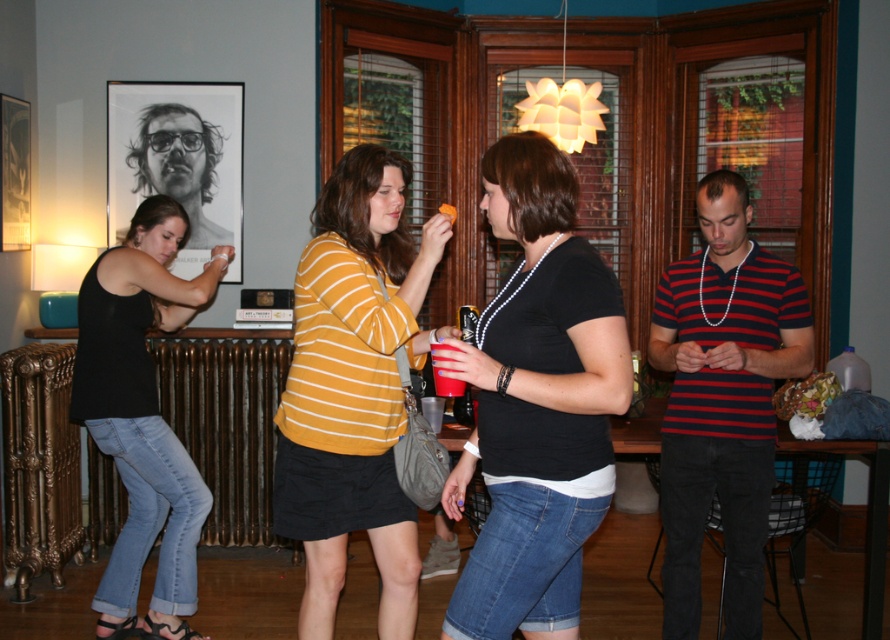
Between point (178, 113) and point (449, 394), which one is positioned behind?

The point (178, 113) is more distant.

Who is taller, matte black portrait at upper left or matte plastic cup at center?

matte black portrait at upper left is taller.

Is point (162, 180) farther from viewer compared to point (441, 378)?

Yes, point (162, 180) is behind point (441, 378).

At what (x,y) coordinates should I click in order to perform the action: click on matte black portrait at upper left. Please return your answer as a coordinate pair (x, y). Image resolution: width=890 pixels, height=640 pixels. Looking at the image, I should click on (179, 164).

Does striped cotton shirt at right appear on the left side of black denim jeans at left?

In fact, striped cotton shirt at right is to the right of black denim jeans at left.

Is striped cotton shirt at right smaller than black denim jeans at left?

Indeed, striped cotton shirt at right has a smaller size compared to black denim jeans at left.

Is point (727, 397) in front of point (166, 611)?

Yes, point (727, 397) is closer to viewer.

At what (x,y) coordinates should I click in order to perform the action: click on striped cotton shirt at right. Please return your answer as a coordinate pair (x, y). Image resolution: width=890 pixels, height=640 pixels. Looking at the image, I should click on (722, 401).

Is black matte shirt at center to the right of yellow striped shirt at center from the viewer's perspective?

Yes, black matte shirt at center is to the right of yellow striped shirt at center.

Which is more to the left, black matte shirt at center or yellow striped shirt at center?

From the viewer's perspective, yellow striped shirt at center appears more on the left side.

Where is `black matte shirt at center`? The height and width of the screenshot is (640, 890). black matte shirt at center is located at coordinates (537, 403).